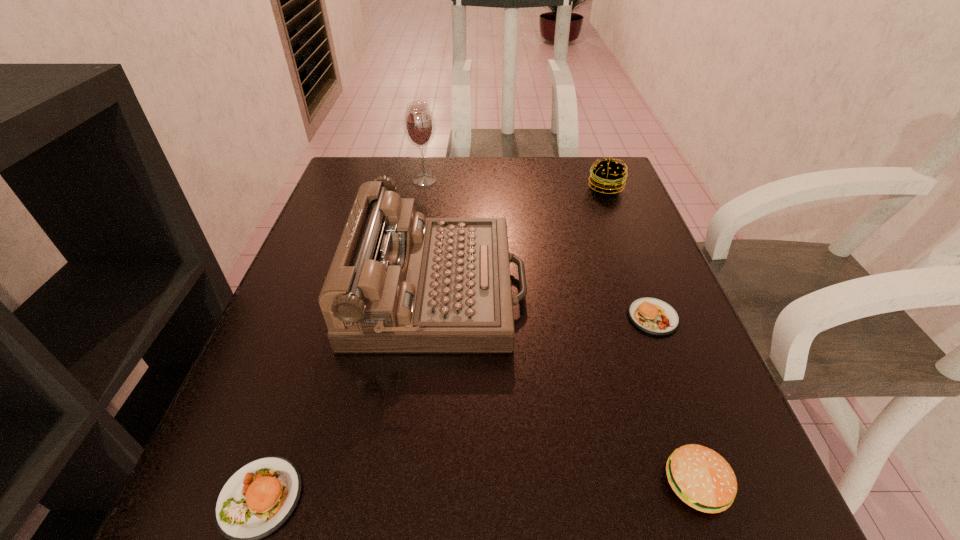
Where is `free space at the near right corner`? The width and height of the screenshot is (960, 540). free space at the near right corner is located at coordinates tap(643, 478).

Locate an element on the screen. The width and height of the screenshot is (960, 540). free spot between the typewriter and the farthest patty is located at coordinates (522, 238).

Locate an element on the screen. This screenshot has height=540, width=960. vacant space that's between the typewriter and the tallest patty is located at coordinates (522, 238).

At what (x,y) coordinates should I click in order to perform the action: click on free spot between the wineglass and the third nearest patty. Please return your answer as a coordinate pair (x, y). This screenshot has width=960, height=540. Looking at the image, I should click on (539, 249).

Where is `object that is the closest to the third nearest patty`? object that is the closest to the third nearest patty is located at coordinates (399, 282).

Identify the location of the fifth closest object to the wineglass. This screenshot has height=540, width=960. (700, 477).

The height and width of the screenshot is (540, 960). What are the coordinates of `patty that stands as the closest to the fourth shortest object` in the screenshot? It's located at (653, 316).

Where is `patty that is the second closest one to the farthest patty`? Image resolution: width=960 pixels, height=540 pixels. patty that is the second closest one to the farthest patty is located at coordinates (700, 477).

The width and height of the screenshot is (960, 540). In order to click on free space that satisfies the following two spatial constraints: 1. on the keyboard of the typewriter; 2. on the left side of the third nearest patty in this screenshot , I will do `click(436, 317)`.